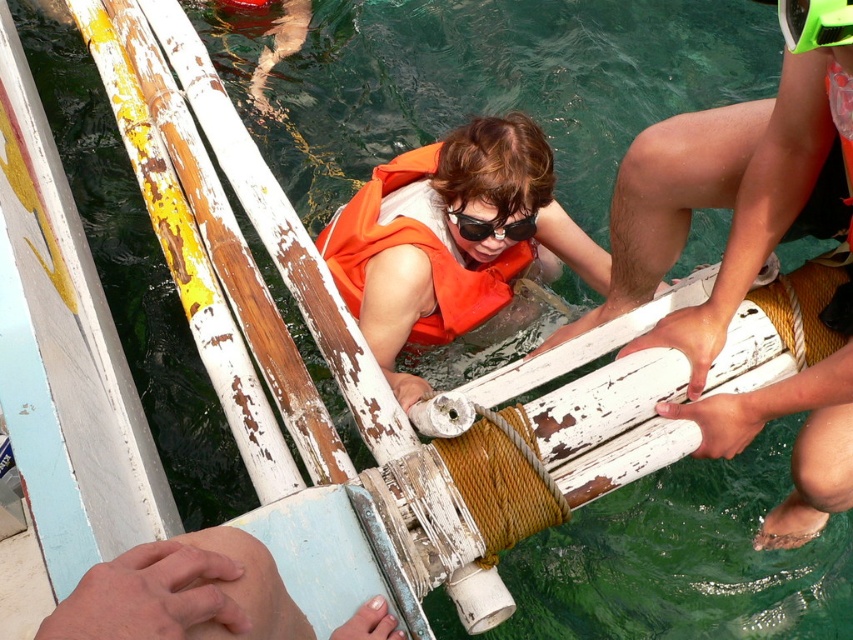
Question: Is smooth skin hand at lower left further to the viewer compared to orange fabric life jacket at center?

Choices:
 (A) no
 (B) yes

Answer: (A)

Question: Does smooth skin hand at lower left have a smaller size compared to black plastic goggles at center?

Choices:
 (A) no
 (B) yes

Answer: (A)

Question: Which object is farther from the camera taking this photo?

Choices:
 (A) smooth skin hand at lower left
 (B) orange fabric life jacket at center

Answer: (B)

Question: Considering the real-world distances, which object is closest to the black plastic goggles at center?

Choices:
 (A) orange fabric life jacket at center
 (B) smooth skin hand at lower left

Answer: (A)

Question: Which of the following is the farthest from the observer?

Choices:
 (A) smooth skin hand at lower left
 (B) black plastic goggles at center

Answer: (B)

Question: Is smooth skin hand at lower left positioned at the back of black plastic goggles at center?

Choices:
 (A) yes
 (B) no

Answer: (B)